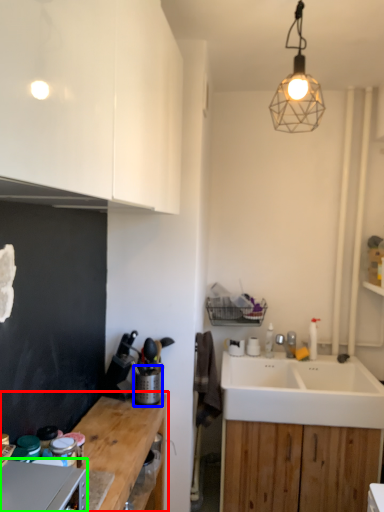
Question: Based on their relative distances, which object is farther from countertop (highlighted by a red box)? Choose from appliance (highlighted by a blue box) and appliance (highlighted by a green box).

Choices:
 (A) appliance
 (B) appliance

Answer: (B)